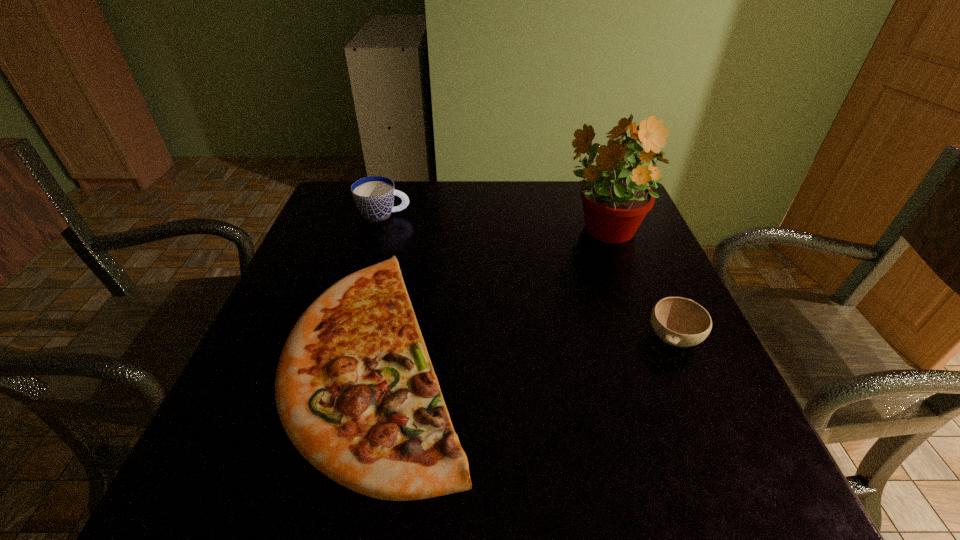
Where is `free space at the right edge of the desktop`? free space at the right edge of the desktop is located at coordinates (671, 396).

Image resolution: width=960 pixels, height=540 pixels. Identify the location of free space at the far left corner. (362, 219).

The height and width of the screenshot is (540, 960). Find the location of `vacant space at the near left corner`. vacant space at the near left corner is located at coordinates (213, 477).

Locate an element on the screen. vacant space that is in between the cup and the bowl is located at coordinates (529, 276).

Find the location of `vacant region between the bowl and the pizza`. vacant region between the bowl and the pizza is located at coordinates (526, 347).

Locate an element on the screen. This screenshot has width=960, height=540. vacant space that's between the cup and the flowerpot is located at coordinates (493, 223).

I want to click on free space between the flowerpot and the cup, so click(x=493, y=223).

Image resolution: width=960 pixels, height=540 pixels. I want to click on vacant area that lies between the pizza and the bowl, so click(526, 347).

You are a GUI agent. You are given a task and a screenshot of the screen. Output one action in this format:
    pyautogui.click(x=<x>, y=<y>)
    Task: Click on the free space between the bowl and the tallest object
    The width and height of the screenshot is (960, 540).
    Given the screenshot: What is the action you would take?
    pyautogui.click(x=637, y=285)

Locate an element on the screen. free spot between the second tallest object and the tallest object is located at coordinates (493, 223).